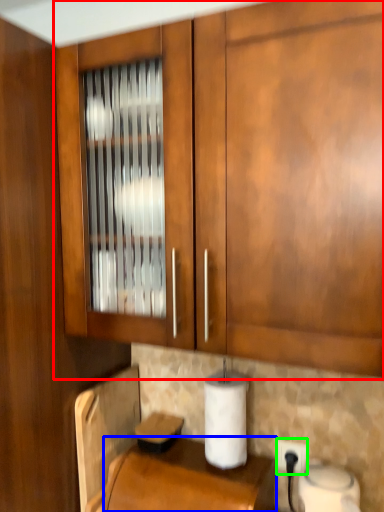
Question: Which is farther away from cabinetry (highlighted by a red box)? counter top (highlighted by a blue box) or electric outlet (highlighted by a green box)?

Choices:
 (A) counter top
 (B) electric outlet

Answer: (B)